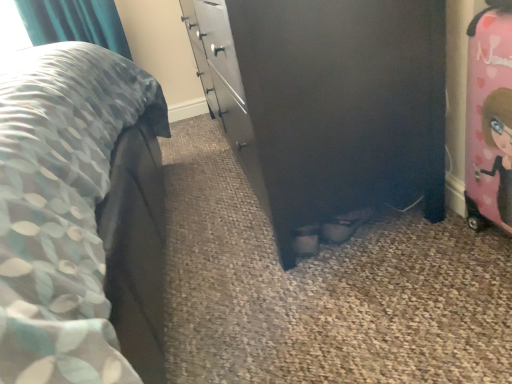
This screenshot has width=512, height=384. I want to click on free space to the left of pink glossy suitcase at right, so click(x=436, y=246).